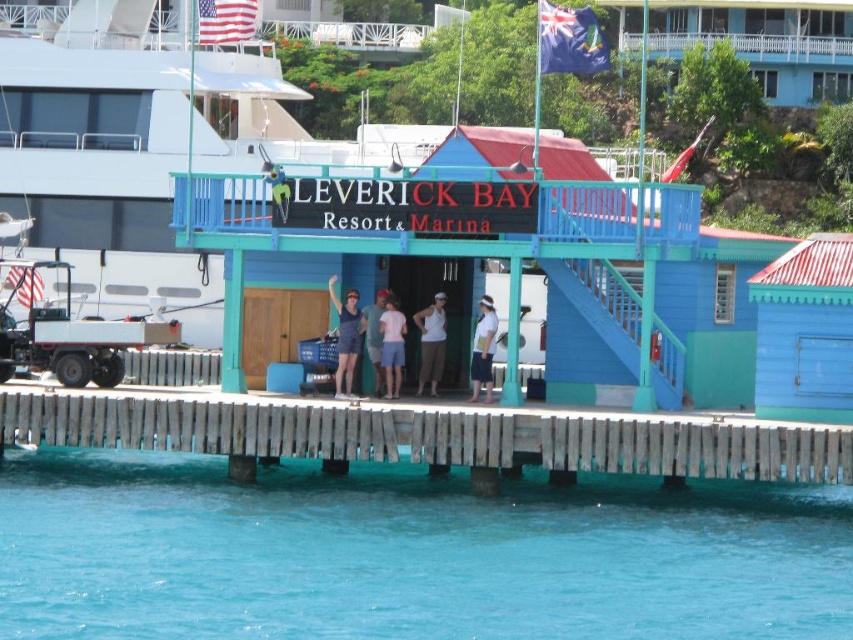
Question: Which object is closer to the camera taking this photo?

Choices:
 (A) denim shorts at center
 (B) transparent blue water at lower center
 (C) white fabric shirt at center
 (D) blue wood hut at center

Answer: (B)

Question: Which object is closer to the camera taking this photo?

Choices:
 (A) pink fabric shorts at center
 (B) wooden planks at lower center

Answer: (B)

Question: In this image, where is wooden planks at lower center located relative to white fabric shirt at center?

Choices:
 (A) below
 (B) above

Answer: (A)

Question: Is blue wood hut at center behind white cotton tank top at center?

Choices:
 (A) yes
 (B) no

Answer: (B)

Question: Which point appears closest to the camera in this image?

Choices:
 (A) (537, 525)
 (B) (779, 376)
 (C) (355, 349)

Answer: (A)

Question: Can you confirm if transparent blue water at lower center is smaller than blue wood hut at center?

Choices:
 (A) yes
 (B) no

Answer: (B)